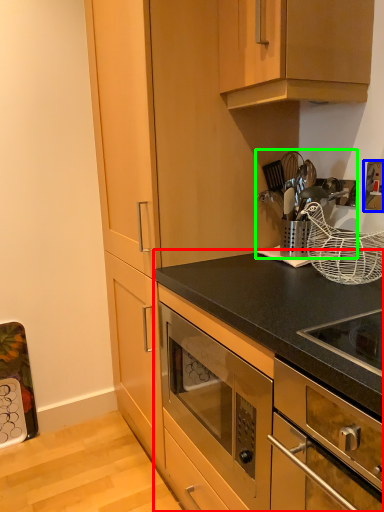
Question: Which object is positioned closest to cabinetry (highlighted by a red box)? Select from electric outlet (highlighted by a blue box) and appliance (highlighted by a green box).

Choices:
 (A) electric outlet
 (B) appliance

Answer: (B)